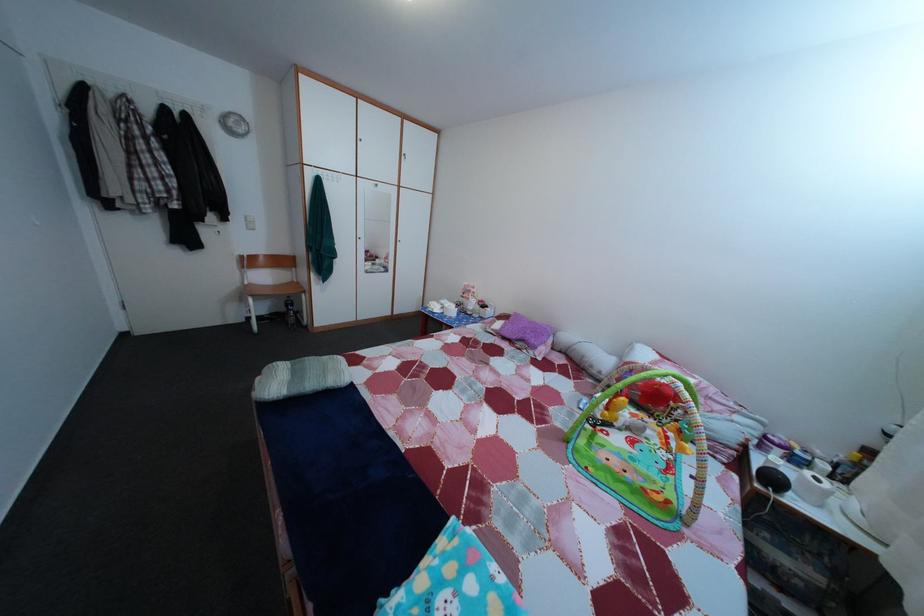
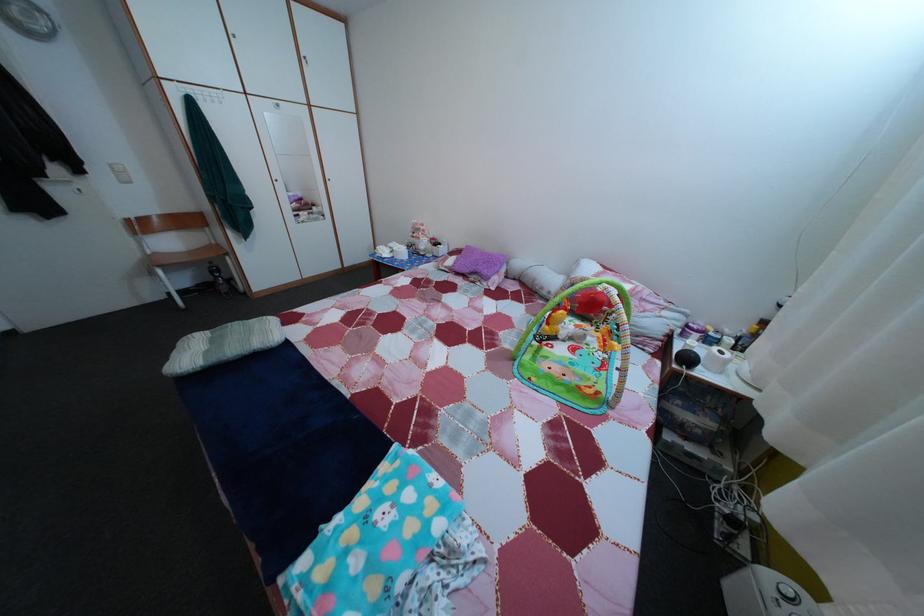
Where in the second image is the point corresponding to pixel 806 469 from the first image?

(718, 349)